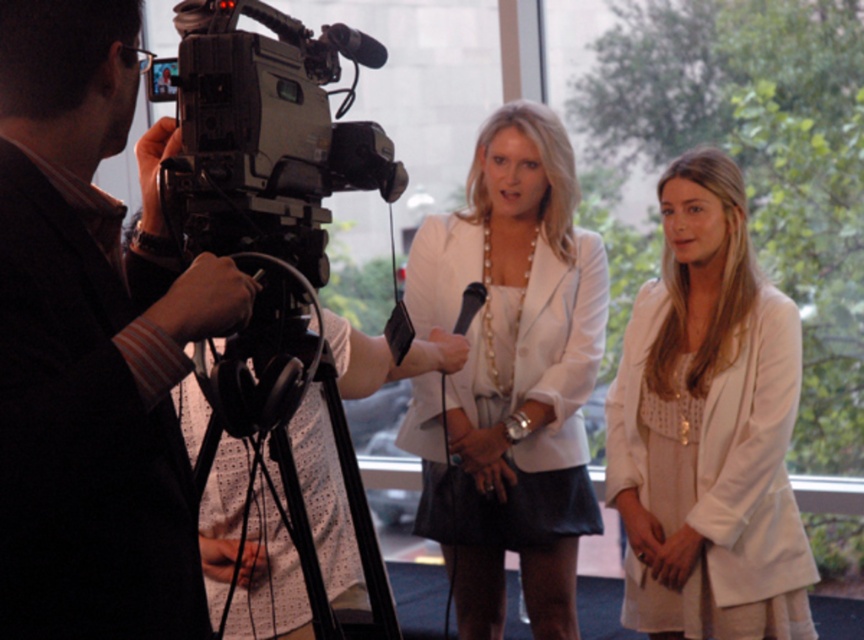
What object in the scene is located at the coordinates point (92, 342)?

The black fabric camera at left is located at point (92, 342).